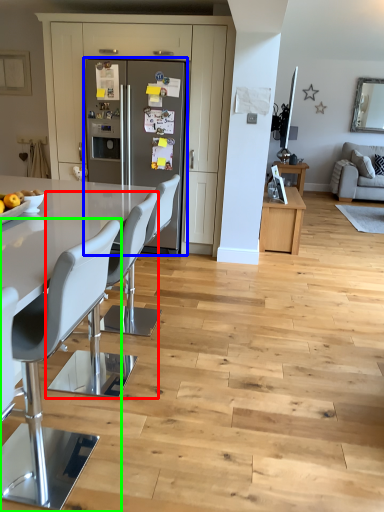
Question: Which is farther away from chair (highlighted by a red box)? fridge (highlighted by a blue box) or chair (highlighted by a green box)?

Choices:
 (A) fridge
 (B) chair

Answer: (A)